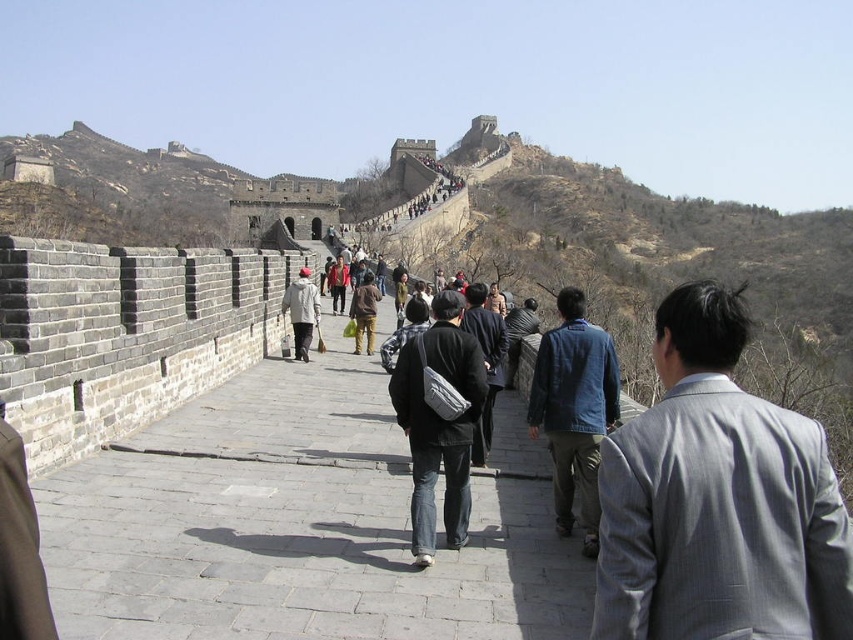
Question: Which object is positioned farthest from the denim jacket at center?

Choices:
 (A) light gray wool coat at center
 (B) red jacket at center

Answer: (B)

Question: Which point is farther to the camera?

Choices:
 (A) (335, 268)
 (B) (495, 381)

Answer: (A)

Question: Among these points, which one is nearest to the camera?

Choices:
 (A) (418, 490)
 (B) (473, 312)
 (C) (643, 452)

Answer: (C)

Question: Is light gray wool coat at center behind red jacket at center?

Choices:
 (A) yes
 (B) no

Answer: (B)

Question: Is denim jacket at center smaller than red jacket at center?

Choices:
 (A) yes
 (B) no

Answer: (B)

Question: Does gray stone path at center appear under dark gray jacket at center?

Choices:
 (A) yes
 (B) no

Answer: (A)